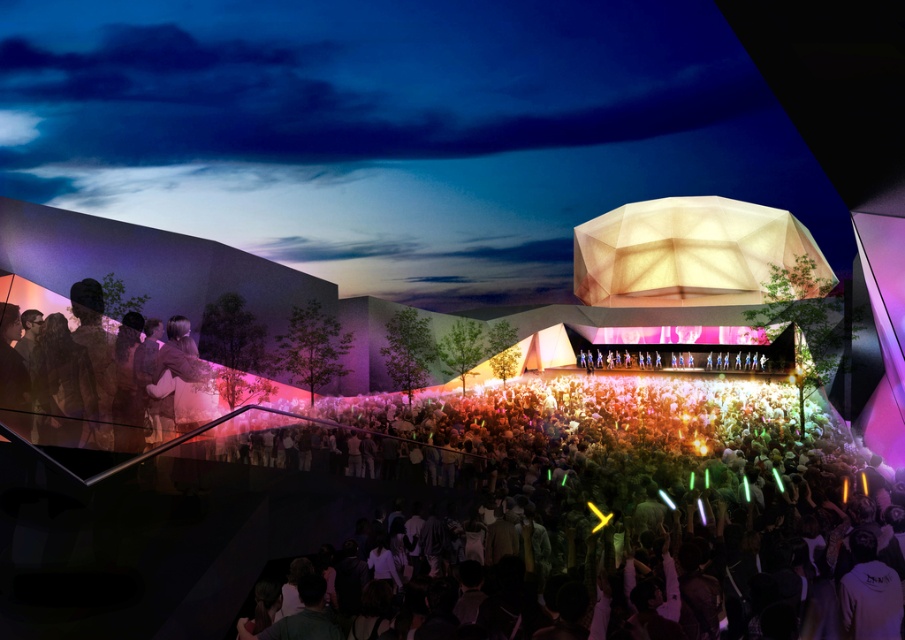
You are a photographer at the concert wanting to capture both the multicolored glow sticks at center and the silhouette fabric at left in a single shot. Which object will appear larger in the photo?

The multicolored glow sticks at center will appear larger in the photo because they are closer to the viewer than the silhouette fabric at left.

You are at the concert and want to take a photo that captures both the multicolored glow sticks at center and the silhouette fabric at left. Since you want both to be clearly visible in the frame, which object should you position closer to the camera to ensure they appear the same size in your photo?

To make the multicolored glow sticks at center and the silhouette fabric at left appear the same size in the photo, position the multicolored glow sticks at center farther from the camera than the silhouette fabric at left because the glow sticks are wider. This way, their actual size difference will be balanced by their distance from the camera, resulting in similar apparent sizes in the photo.